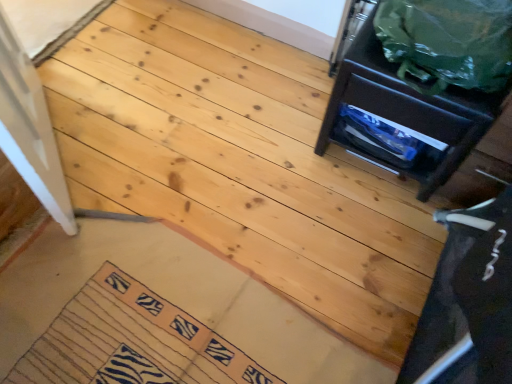
Locate an element on the screen. This screenshot has width=512, height=384. free point behind zebra-patterned fabric mat at lower left is located at coordinates (170, 231).